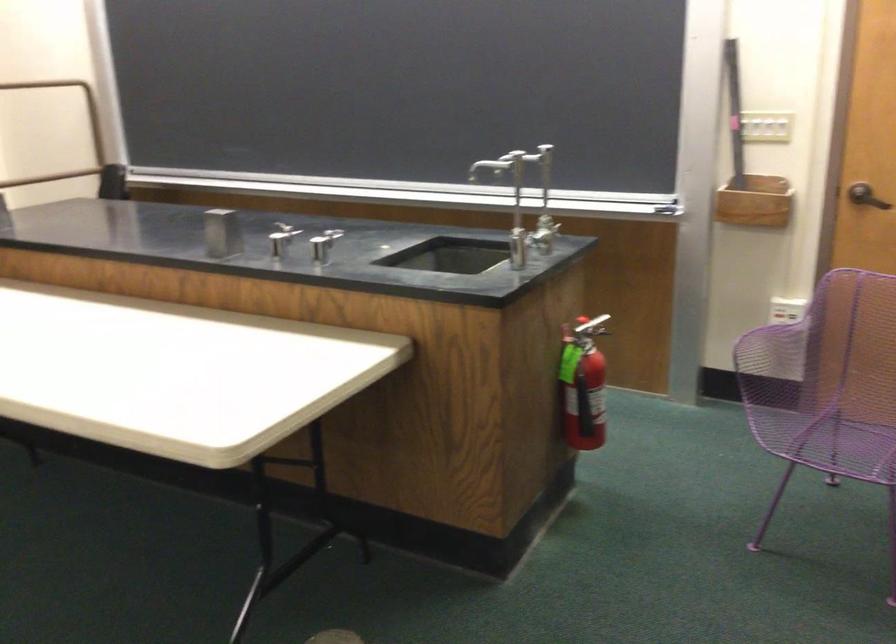
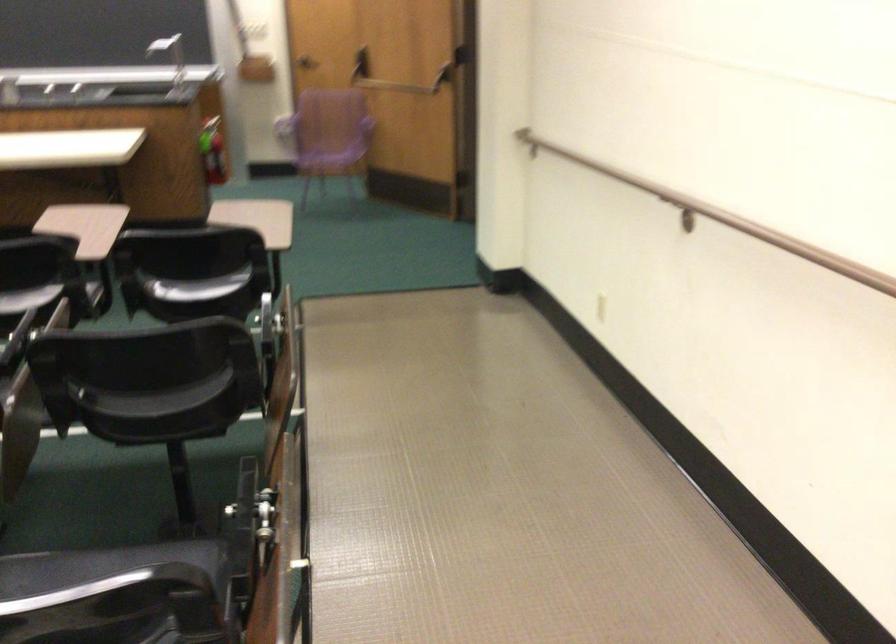
In the second image, find the point that corresponds to (590,327) in the first image.

(217, 124)